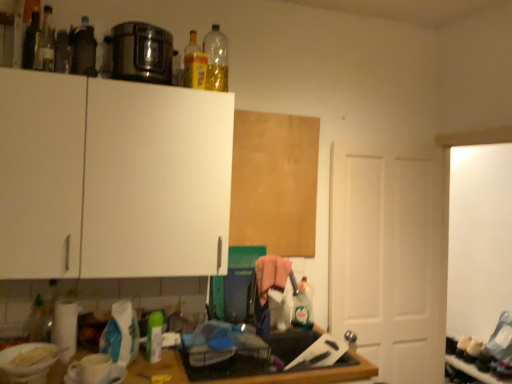
Question: Considering the relative sizes of white matte cabinet at upper left, which appears as the second cabinetry when viewed from the back, and translucent plastic bottle at lower right, which is counted as the eighth bottle, starting from the front, in the image provided, is white matte cabinet at upper left, which appears as the second cabinetry when viewed from the back, shorter than translucent plastic bottle at lower right, which is counted as the eighth bottle, starting from the front,?

Choices:
 (A) no
 (B) yes

Answer: (A)

Question: From the image's perspective, is white matte cabinet at upper left, which appears as the second cabinetry when viewed from the back, below translucent plastic bottle at lower right, the eighth bottle when ordered from top to bottom?

Choices:
 (A) no
 (B) yes

Answer: (A)

Question: Can you confirm if white matte cabinet at upper left, the 1th cabinetry when ordered from left to right, is smaller than translucent plastic bottle at lower right, the eighth bottle when ordered from top to bottom?

Choices:
 (A) yes
 (B) no

Answer: (B)

Question: Is white matte cabinet at upper left, the first cabinetry when ordered from front to back, thinner than translucent plastic bottle at lower right, the eighth bottle when ordered from left to right?

Choices:
 (A) yes
 (B) no

Answer: (B)

Question: From the image's perspective, is white matte cabinet at upper left, the first cabinetry when ordered from front to back, on top of translucent plastic bottle at lower right, marked as the 1th bottle in a right-to-left arrangement?

Choices:
 (A) no
 (B) yes

Answer: (B)

Question: From a real-world perspective, is white matte cabinet at upper left, which appears as the second cabinetry when viewed from the back, on top of translucent plastic bottle at lower right, marked as the 1th bottle in a right-to-left arrangement?

Choices:
 (A) yes
 (B) no

Answer: (A)

Question: Is translucent glass bottle at upper left, the sixth bottle from the bottom, positioned with its back to green matte spray can at lower center, marked as the 5th bottle in a right-to-left arrangement?

Choices:
 (A) no
 (B) yes

Answer: (A)

Question: Is translucent glass bottle at upper left, acting as the seventh bottle starting from the back, at the right side of green matte spray can at lower center, positioned as the 4th bottle in left-to-right order?

Choices:
 (A) no
 (B) yes

Answer: (A)

Question: Would you consider translucent glass bottle at upper left, the 2th bottle in the left-to-right sequence, to be distant from green matte spray can at lower center, the 5th bottle viewed from the back?

Choices:
 (A) no
 (B) yes

Answer: (B)

Question: Is the depth of translucent glass bottle at upper left, acting as the seventh bottle starting from the back, less than that of green matte spray can at lower center, the second bottle when ordered from bottom to top?

Choices:
 (A) yes
 (B) no

Answer: (A)

Question: Does translucent glass bottle at upper left, the sixth bottle from the bottom, turn towards green matte spray can at lower center, positioned as the 4th bottle in left-to-right order?

Choices:
 (A) yes
 (B) no

Answer: (B)

Question: Can you see translucent glass bottle at upper left, acting as the seventh bottle starting from the back, touching green matte spray can at lower center, the fourth bottle from the front?

Choices:
 (A) no
 (B) yes

Answer: (A)

Question: Is white matte door at right at the back of green matte spray can at lower center, positioned as the 4th bottle in left-to-right order?

Choices:
 (A) no
 (B) yes

Answer: (A)